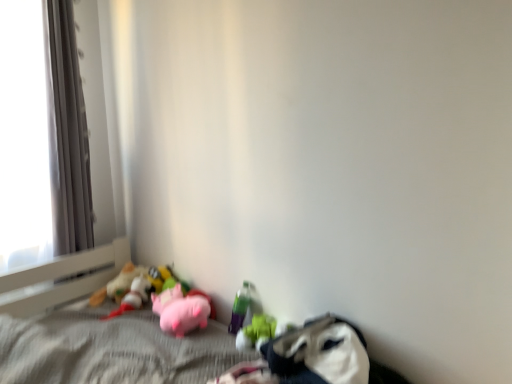
Question: Is soft plush toys at lower left, placed as the 1th toy when sorted from left to right, bigger or smaller than translucent plastic bottle at lower center, positioned as the third toy in left-to-right order?

Choices:
 (A) small
 (B) big

Answer: (B)

Question: Is soft plush toys at lower left, marked as the 4th toy in a right-to-left arrangement, inside the boundaries of translucent plastic bottle at lower center, positioned as the third toy in left-to-right order, or outside?

Choices:
 (A) outside
 (B) inside

Answer: (A)

Question: Estimate the real-world distances between objects in this image. Which object is farther from the pink plush toys at lower left?

Choices:
 (A) soft plush toys at lower left, placed as the 1th toy when sorted from left to right
 (B) pink plush pig at center
 (C) translucent plastic bottle at lower center, placed as the second toy when sorted from right to left
 (D) white plastic window frame at left
 (E) rubber duck at lower center, arranged as the 4th toy when viewed from the left

Answer: (C)

Question: Estimate the real-world distances between objects in this image. Which object is farther from the translucent plastic bottle at lower center, placed as the second toy when sorted from right to left?

Choices:
 (A) rubber duck at lower center, which ranks as the first toy in right-to-left order
 (B) pink plush pig at center
 (C) pink plush toys at lower left
 (D) pink plush pig at lower center, the third toy when ordered from right to left
 (E) soft plush toys at lower left, marked as the 4th toy in a right-to-left arrangement

Answer: (E)